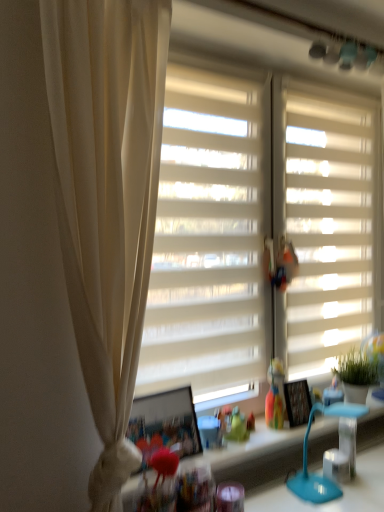
Question: From the image's perspective, is translucent plastic toy at center above or below matte blue table lamp at lower right?

Choices:
 (A) below
 (B) above

Answer: (B)

Question: Considering their positions, is translucent plastic toy at center located in front of or behind matte blue table lamp at lower right?

Choices:
 (A) front
 (B) behind

Answer: (B)

Question: Based on their relative distances, which object is nearer to the translucent plastic toy at center?

Choices:
 (A) matte blue table lamp at lower right
 (B) white matte window screen at center
 (C) white matte window blind at right

Answer: (A)

Question: Estimate the real-world distances between objects in this image. Which object is closer to the white matte window screen at center?

Choices:
 (A) translucent plastic toy at center
 (B) white matte window blind at right
 (C) matte blue table lamp at lower right

Answer: (B)